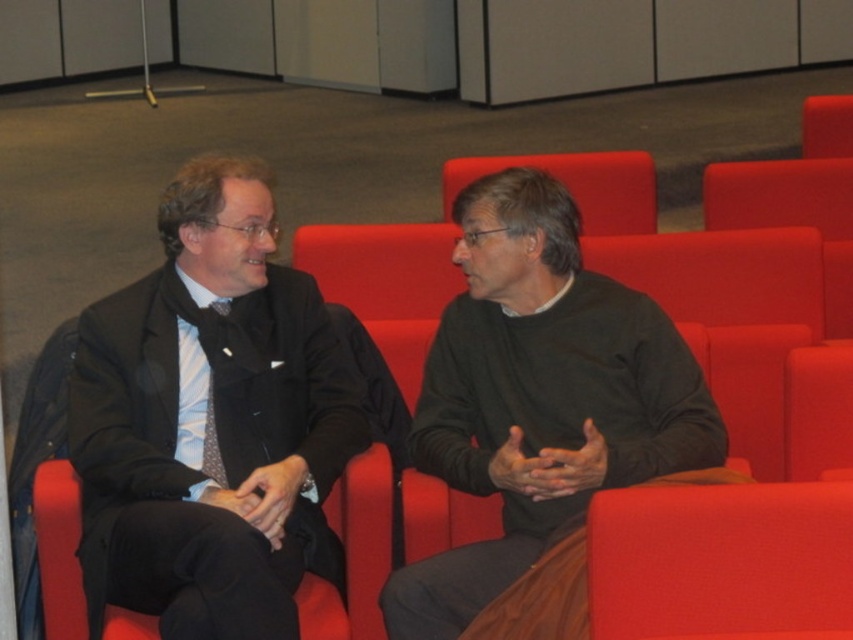
Question: Observing the image, what is the correct spatial positioning of matte black suit at center in reference to dark green sweater at center?

Choices:
 (A) above
 (B) below

Answer: (A)

Question: Which object appears closest to the camera in this image?

Choices:
 (A) matte black suit at center
 (B) dark green sweater at center

Answer: (A)

Question: Where is matte black suit at center located in relation to dark green sweater at center in the image?

Choices:
 (A) right
 (B) left

Answer: (B)

Question: Which of the following is the closest to the observer?

Choices:
 (A) matte black suit at center
 (B) dark green sweater at center

Answer: (A)

Question: Among these points, which one is nearest to the camera?

Choices:
 (A) (436, 344)
 (B) (225, 500)

Answer: (B)

Question: Considering the relative positions of matte black suit at center and dark green sweater at center in the image provided, where is matte black suit at center located with respect to dark green sweater at center?

Choices:
 (A) above
 (B) below

Answer: (A)